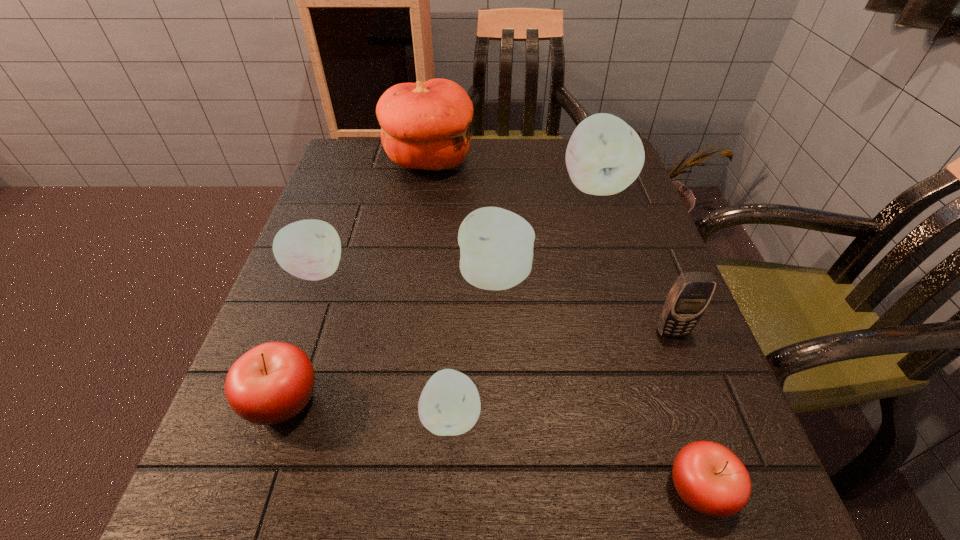
You are a GUI agent. You are given a task and a screenshot of the screen. Output one action in this format:
    pyautogui.click(x=<x>, y=<y>)
    Task: Click on the apple that is at the far edge
    The height and width of the screenshot is (540, 960).
    Given the screenshot: What is the action you would take?
    coord(604,155)

Where is `object that is at the near edge`? This screenshot has height=540, width=960. object that is at the near edge is located at coordinates (709, 478).

Where is `pumpkin at the left edge`? pumpkin at the left edge is located at coordinates (425, 125).

Find the location of `cellular telephone located in the right edge section of the desktop`. cellular telephone located in the right edge section of the desktop is located at coordinates 687,300.

The width and height of the screenshot is (960, 540). What are the coordinates of `object located at the far left corner` in the screenshot? It's located at (425, 125).

Identify the location of object at the far right corner. This screenshot has height=540, width=960. (604, 155).

Locate an element on the screen. object that is positioned at the near right corner is located at coordinates (709, 478).

Find the location of `vacant space at the far edge of the desktop`. vacant space at the far edge of the desktop is located at coordinates (534, 148).

Image resolution: width=960 pixels, height=540 pixels. What are the coordinates of `vacant space at the left edge of the desktop` in the screenshot? It's located at (348, 344).

Find the location of a particular element. This screenshot has height=540, width=960. free point at the right edge is located at coordinates (601, 298).